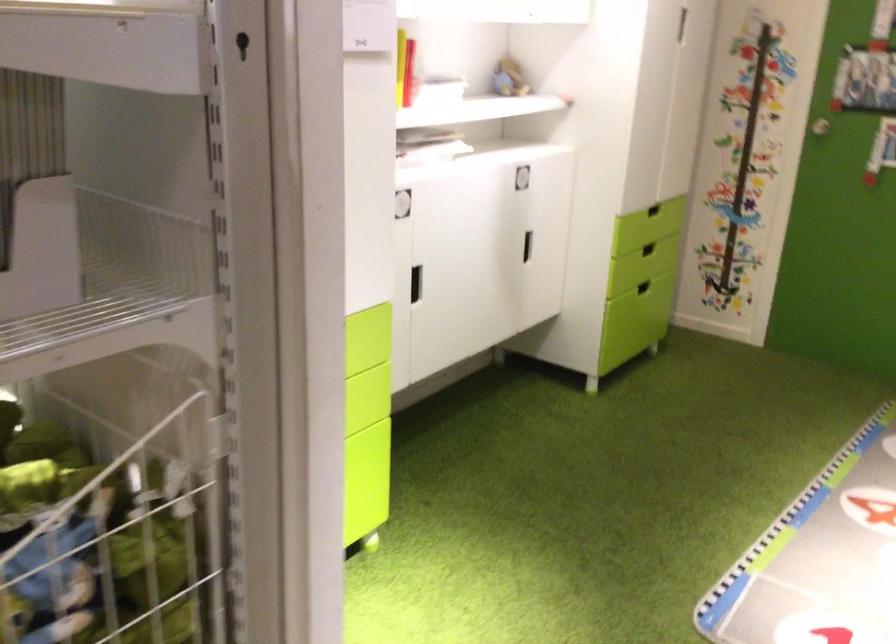
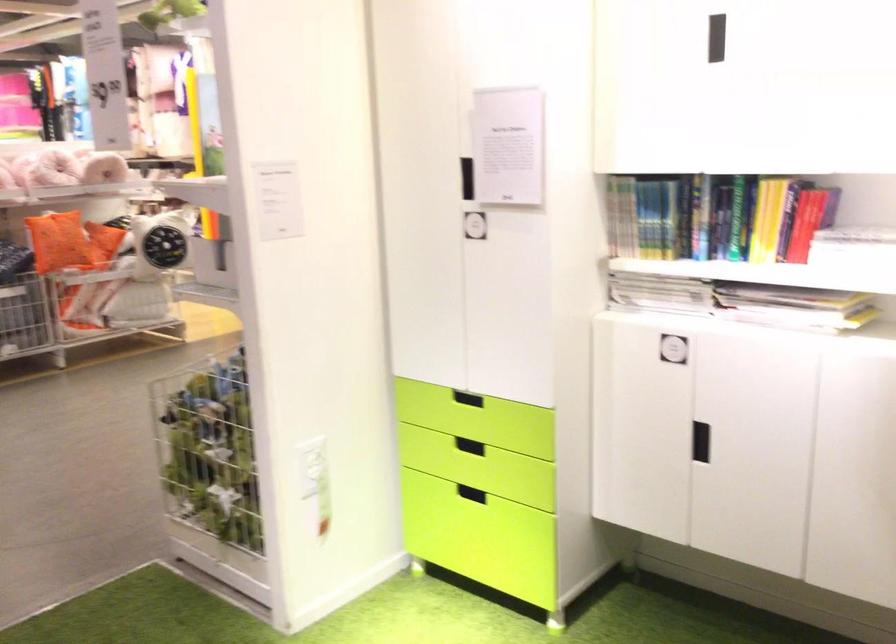
Where in the second image is the point corresponding to point (441, 89) from the first image?

(853, 245)